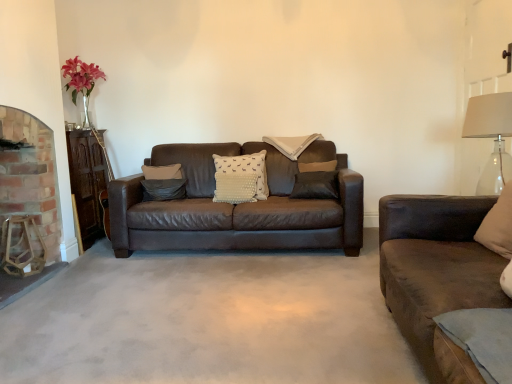
This screenshot has width=512, height=384. Describe the element at coordinates (498, 225) in the screenshot. I see `beige fabric pillow at right, which ranks as the first pillow in right-to-left order` at that location.

Measure the distance between point (476,127) and camera.

The distance of point (476,127) from camera is 2.34 meters.

Identify the location of white dotted fabric pillow at center, which is the 2th pillow in left-to-right order. This screenshot has width=512, height=384. (240, 178).

Where is `beige fabric pillow at right, which ranks as the first pillow in right-to-left order`? The image size is (512, 384). beige fabric pillow at right, which ranks as the first pillow in right-to-left order is located at coordinates (498, 225).

Who is bigger, beige fabric pillow at right, which is counted as the fourth pillow, starting from the back, or suede pillow at center, arranged as the second pillow when viewed from the back?

beige fabric pillow at right, which is counted as the fourth pillow, starting from the back, is bigger.

Is point (495, 227) positioned behind point (144, 186)?

That is False.

Which is more to the left, beige fabric pillow at right, which is counted as the fourth pillow, starting from the back, or suede pillow at center, the first pillow viewed from the left?

suede pillow at center, the first pillow viewed from the left, is more to the left.

Consider the image. Can you confirm if white dotted fabric pillow at center, arranged as the third pillow when viewed from the right, is positioned to the left of clear glass lampshade at right?

Correct, you'll find white dotted fabric pillow at center, arranged as the third pillow when viewed from the right, to the left of clear glass lampshade at right.

Which is behind, white dotted fabric pillow at center, which is counted as the 3th pillow, starting from the back, or clear glass lampshade at right?

white dotted fabric pillow at center, which is counted as the 3th pillow, starting from the back, is behind.

From the image's perspective, which is above, white dotted fabric pillow at center, which is counted as the 3th pillow, starting from the back, or clear glass lampshade at right?

clear glass lampshade at right, from the image's perspective.

Is white dotted fabric pillow at center, which is the 2th pillow in left-to-right order, taller or shorter than suede pillow at center, the 3th pillow when ordered from front to back?

In the image, white dotted fabric pillow at center, which is the 2th pillow in left-to-right order, appears to be taller than suede pillow at center, the 3th pillow when ordered from front to back.

Based on the photo, how many degrees apart are the facing directions of white dotted fabric pillow at center, arranged as the third pillow when viewed from the right, and suede pillow at center, arranged as the second pillow when viewed from the back?

The angle between the facing direction of white dotted fabric pillow at center, arranged as the third pillow when viewed from the right, and the facing direction of suede pillow at center, arranged as the second pillow when viewed from the back, is 25.4 degrees.

Between white dotted fabric pillow at center, arranged as the third pillow when viewed from the right, and suede pillow at center, which ranks as the fourth pillow in right-to-left order, which one has smaller size?

suede pillow at center, which ranks as the fourth pillow in right-to-left order.

Is point (221, 174) positioned in front of point (151, 182)?

Yes, it is.

Does suede pillow at center, the first pillow viewed from the left, have a greater width compared to white dotted pillow at center, the 4th pillow when ordered from front to back?

No.

Can we say suede pillow at center, arranged as the second pillow when viewed from the back, lies outside white dotted pillow at center, the 3th pillow in the left-to-right sequence?

Yes, suede pillow at center, arranged as the second pillow when viewed from the back, is located beyond the bounds of white dotted pillow at center, the 3th pillow in the left-to-right sequence.

Which object is positioned more to the right, suede pillow at center, the first pillow viewed from the left, or white dotted pillow at center, the 3th pillow in the left-to-right sequence?

From the viewer's perspective, white dotted pillow at center, the 3th pillow in the left-to-right sequence, appears more on the right side.

From a real-world perspective, is suede pillow at center, arranged as the second pillow when viewed from the back, located higher than white dotted pillow at center, the 1th pillow from the back?

Actually, suede pillow at center, arranged as the second pillow when viewed from the back, is physically below white dotted pillow at center, the 1th pillow from the back, in the real world.

From the image's perspective, between clear glass lampshade at right and white dotted fabric pillow at center, which appears as the second pillow when viewed from the front, which one is located above?

clear glass lampshade at right.

In the image, is clear glass lampshade at right positioned in front of or behind white dotted fabric pillow at center, arranged as the third pillow when viewed from the right?

clear glass lampshade at right is in front of white dotted fabric pillow at center, arranged as the third pillow when viewed from the right.

Is clear glass lampshade at right not close to white dotted fabric pillow at center, which is counted as the 3th pillow, starting from the back?

Yes, clear glass lampshade at right is far from white dotted fabric pillow at center, which is counted as the 3th pillow, starting from the back.

Considering the sizes of objects clear glass lampshade at right and white dotted fabric pillow at center, which is the 2th pillow in left-to-right order, in the image provided, who is taller, clear glass lampshade at right or white dotted fabric pillow at center, which is the 2th pillow in left-to-right order,?

clear glass lampshade at right.

Is white dotted pillow at center, the 3th pillow in the left-to-right sequence, facing away from white dotted fabric pillow at center, which appears as the second pillow when viewed from the front?

That's not correct — white dotted pillow at center, the 3th pillow in the left-to-right sequence, is not looking away from white dotted fabric pillow at center, which appears as the second pillow when viewed from the front.

Would you say white dotted pillow at center, the 4th pillow when ordered from front to back, is outside white dotted fabric pillow at center, which appears as the second pillow when viewed from the front?

Yes, white dotted pillow at center, the 4th pillow when ordered from front to back, is outside of white dotted fabric pillow at center, which appears as the second pillow when viewed from the front.

Identify the location of pillow that is the 1st one when counting leftward from the white dotted pillow at center, the 4th pillow when ordered from front to back. The image size is (512, 384). (240, 178).

Is white dotted pillow at center, the 4th pillow when ordered from front to back, in front of white dotted fabric pillow at center, arranged as the third pillow when viewed from the right?

No, white dotted pillow at center, the 4th pillow when ordered from front to back, is behind white dotted fabric pillow at center, arranged as the third pillow when viewed from the right.

Does brick fireplace at left have a larger size compared to white dotted fabric pillow at center, arranged as the third pillow when viewed from the right?

Yes, brick fireplace at left is bigger than white dotted fabric pillow at center, arranged as the third pillow when viewed from the right.

From the picture: From the image's perspective, which one is positioned higher, brick fireplace at left or white dotted fabric pillow at center, which is the 2th pillow in left-to-right order?

white dotted fabric pillow at center, which is the 2th pillow in left-to-right order.

Is point (48, 173) farther from viewer compared to point (249, 165)?

No.

Does brick fireplace at left come behind white dotted fabric pillow at center, which is the 2th pillow in left-to-right order?

No, brick fireplace at left is closer to the camera.

Locate an element on the screen. This screenshot has width=512, height=384. the 2nd pillow in front of the suede pillow at center, which ranks as the fourth pillow in right-to-left order, starting your count from the anchor is located at coordinates (498, 225).

Identify the location of the 1st pillow below the clear glass lampshade at right (from the image's perspective). This screenshot has height=384, width=512. (240, 178).

Looking at the image, which one is located closer to suede pillow at center, which ranks as the fourth pillow in right-to-left order, white dotted pillow at center, the 1th pillow from the back, or clear glass lampshade at right?

white dotted pillow at center, the 1th pillow from the back, lies closer to suede pillow at center, which ranks as the fourth pillow in right-to-left order, than the other object.

Based on their spatial positions, is beige fabric pillow at right, which ranks as the 1th pillow in front-to-back order, or white dotted fabric pillow at center, arranged as the third pillow when viewed from the right, further from brick fireplace at left?

beige fabric pillow at right, which ranks as the 1th pillow in front-to-back order, is positioned further to the anchor brick fireplace at left.

Based on their spatial positions, is white dotted fabric pillow at center, which is the 2th pillow in left-to-right order, or clear glass lampshade at right closer to beige fabric pillow at right, which ranks as the first pillow in right-to-left order?

clear glass lampshade at right lies closer to beige fabric pillow at right, which ranks as the first pillow in right-to-left order, than the other object.

Estimate the real-world distances between objects in this image. Which object is further from brick fireplace at left, white dotted pillow at center, the 1th pillow from the back, or clear glass lampshade at right?

clear glass lampshade at right is further to brick fireplace at left.

When comparing their distances from white dotted fabric pillow at center, arranged as the third pillow when viewed from the right, does beige fabric pillow at right, which ranks as the 1th pillow in front-to-back order, or white dotted pillow at center, the 2th pillow when ordered from right to left, seem further?

Among the two, beige fabric pillow at right, which ranks as the 1th pillow in front-to-back order, is located further to white dotted fabric pillow at center, arranged as the third pillow when viewed from the right.

Looking at this image, which object lies further to the anchor point white dotted fabric pillow at center, which appears as the second pillow when viewed from the front, suede pillow at center, arranged as the second pillow when viewed from the back, or beige fabric pillow at right, which is counted as the fourth pillow, starting from the back?

beige fabric pillow at right, which is counted as the fourth pillow, starting from the back, is positioned further to the anchor white dotted fabric pillow at center, which appears as the second pillow when viewed from the front.

Consider the image. From the image, which object appears to be farther from clear glass lampshade at right, brick fireplace at left or white dotted pillow at center, the 3th pillow in the left-to-right sequence?

brick fireplace at left is further to clear glass lampshade at right.

From the image, which object appears to be farther from beige fabric pillow at right, which is counted as the fourth pillow, starting from the back, brick fireplace at left or suede pillow at center, the 3th pillow when ordered from front to back?

brick fireplace at left is further to beige fabric pillow at right, which is counted as the fourth pillow, starting from the back.

Where is `pillow situated between brick fireplace at left and white dotted fabric pillow at center, arranged as the third pillow when viewed from the right, from left to right`? The width and height of the screenshot is (512, 384). pillow situated between brick fireplace at left and white dotted fabric pillow at center, arranged as the third pillow when viewed from the right, from left to right is located at coordinates (164, 189).

This screenshot has width=512, height=384. Find the location of `table lamp between beige fabric pillow at right, which ranks as the first pillow in right-to-left order, and white dotted pillow at center, the 4th pillow when ordered from front to back, from front to back`. table lamp between beige fabric pillow at right, which ranks as the first pillow in right-to-left order, and white dotted pillow at center, the 4th pillow when ordered from front to back, from front to back is located at coordinates (490, 137).

The height and width of the screenshot is (384, 512). In order to click on pillow between suede pillow at center, the 3th pillow when ordered from front to back, and white dotted pillow at center, the 3th pillow in the left-to-right sequence, in the horizontal direction in this screenshot , I will do `click(240, 178)`.